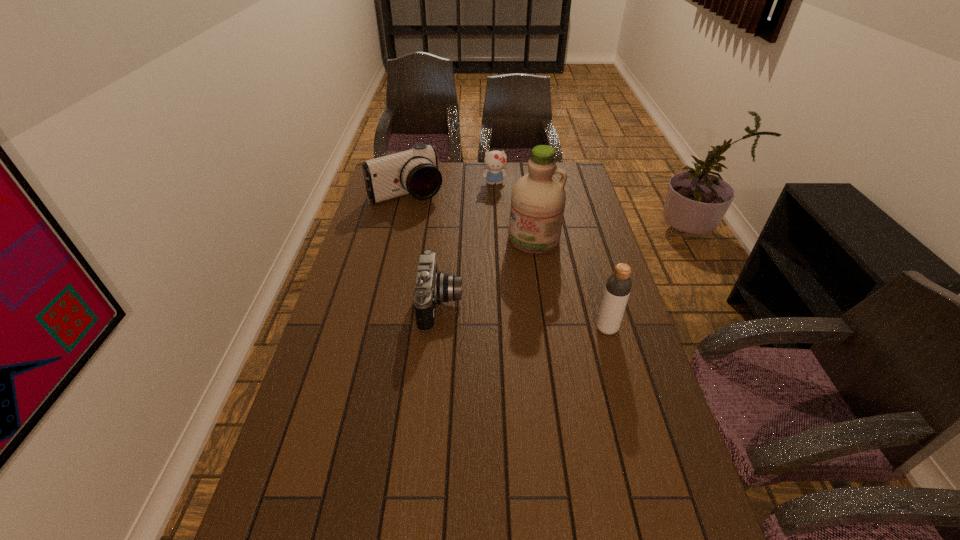
The image size is (960, 540). In order to click on camera in this screenshot , I will do pos(431,288).

Image resolution: width=960 pixels, height=540 pixels. Identify the location of the fourth shortest object. (618, 285).

This screenshot has width=960, height=540. I want to click on bottle, so click(x=618, y=285).

Find the location of a particular element. Image resolution: width=960 pixels, height=540 pixels. kitten is located at coordinates (495, 161).

The image size is (960, 540). I want to click on the tallest object, so click(x=538, y=198).

Identify the location of cleansing agent. This screenshot has width=960, height=540. (538, 198).

The width and height of the screenshot is (960, 540). What are the coordinates of `camcorder` in the screenshot? It's located at (415, 171).

At what (x,y) coordinates should I click in order to perform the action: click on free space located 0.060m on the front-facing side of the camera. Please return your answer as a coordinate pair (x, y). Looking at the image, I should click on (482, 305).

Where is `free spot located on the back of the rightmost object`? The width and height of the screenshot is (960, 540). free spot located on the back of the rightmost object is located at coordinates (593, 279).

At what (x,y) coordinates should I click in order to perform the action: click on vacant region located on the front-facing side of the kitten. Please return your answer as a coordinate pair (x, y). The image size is (960, 540). Looking at the image, I should click on (499, 218).